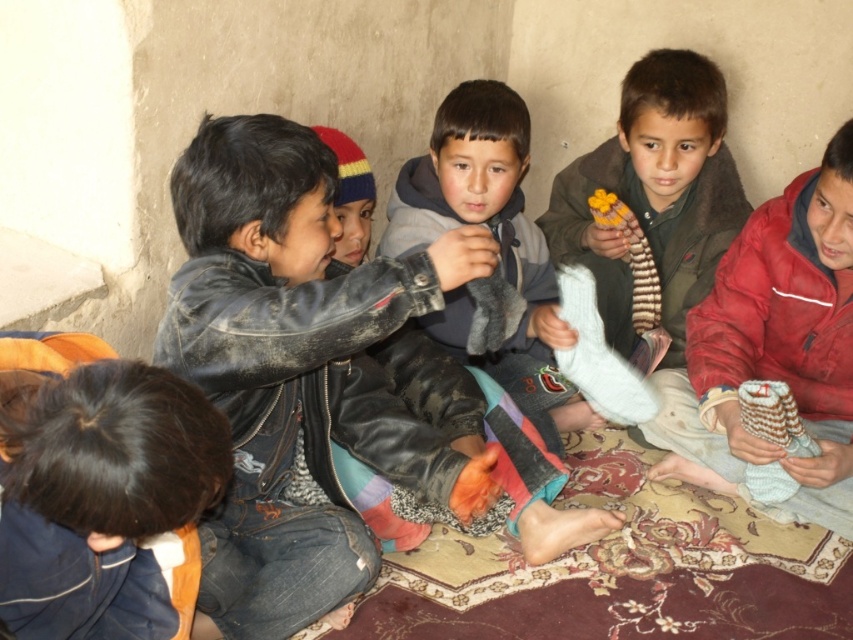
Question: Which is farther from the yellow fabric flower at upper center?

Choices:
 (A) dark blue fabric at lower left
 (B) leather jacket at center

Answer: (A)

Question: Can you confirm if striped fabric toy at center is wider than yellow fabric flower at upper center?

Choices:
 (A) no
 (B) yes

Answer: (B)

Question: Which object is the closest to the knitted gray socks at lower right?

Choices:
 (A) yellow fabric flower at center
 (B) gray fleece jacket at center

Answer: (B)

Question: Which of the following is the closest to the observer?

Choices:
 (A) yellow fabric flower at upper center
 (B) knitted gray socks at lower right

Answer: (B)

Question: Can you confirm if knitted wool socks at right is smaller than knitted gray socks at lower right?

Choices:
 (A) no
 (B) yes

Answer: (A)

Question: Can you confirm if dark blue fabric at lower left is bigger than striped fabric toy at center?

Choices:
 (A) yes
 (B) no

Answer: (A)